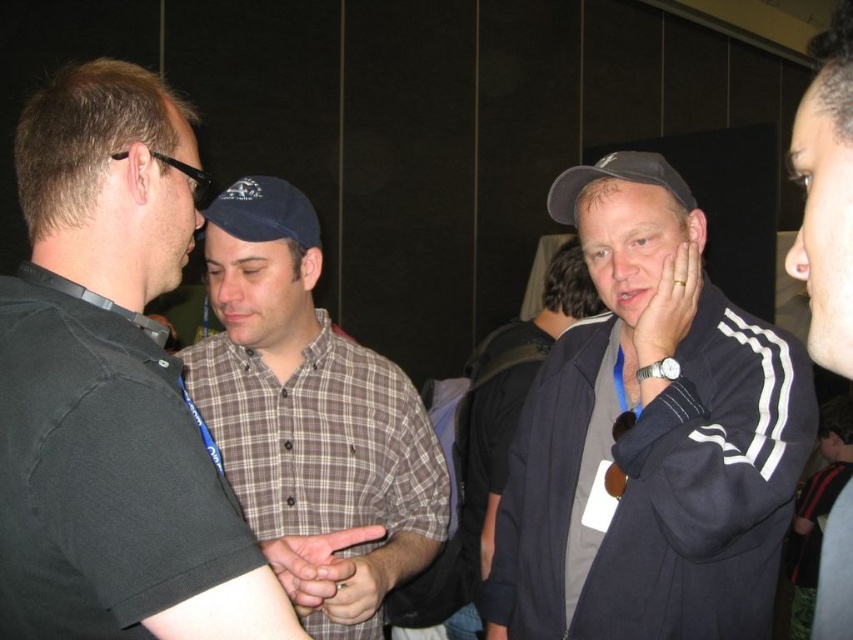
You are at a networking event and see two people in the image. One is wearing a black shirt at left and the other has a blue fabric baseball cap at center. Based on their positions, which one is standing lower in the image?

The black shirt at left is below the blue fabric baseball cap at center, so the person in the black shirt at left is standing lower in the image.

You are standing at the origin point of the coordinate system where the image is displayed. The brown plaid shirt at center is located at point (310, 406). If you want to move towards the brown plaid shirt at center, in which direction should you move?

To move towards the brown plaid shirt at center located at coordinates (310, 406), you should move in the direction of increasing x and y coordinates since the point is in the positive quadrant relative to the origin.

You are standing at the camera position and want to reach the point marked as point [404,484]. If your walking speed is 1.2 meters per second, how many seconds will it take you to reach that point?

The distance between the point [404,484] and the camera is 1.46 meters. At a walking speed of 1.2 meters per second, it would take approximately 1.22 seconds to reach the point.